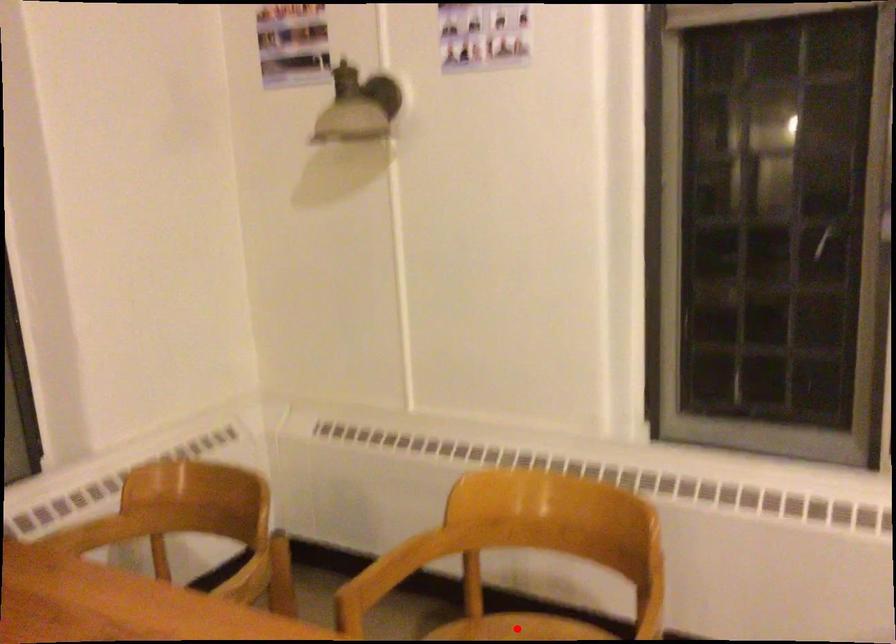
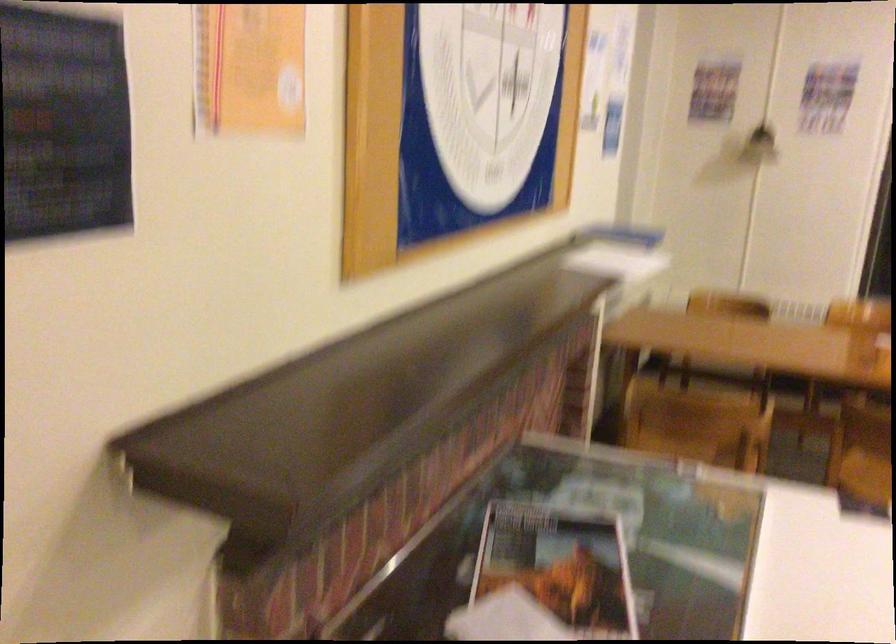
Question: I am providing you with two images of the same scene from different viewpoints. A red point is marked on the first image. At the location where the point appears in image 1, is it still visible in image 2?

Choices:
 (A) Yes
 (B) No

Answer: (B)